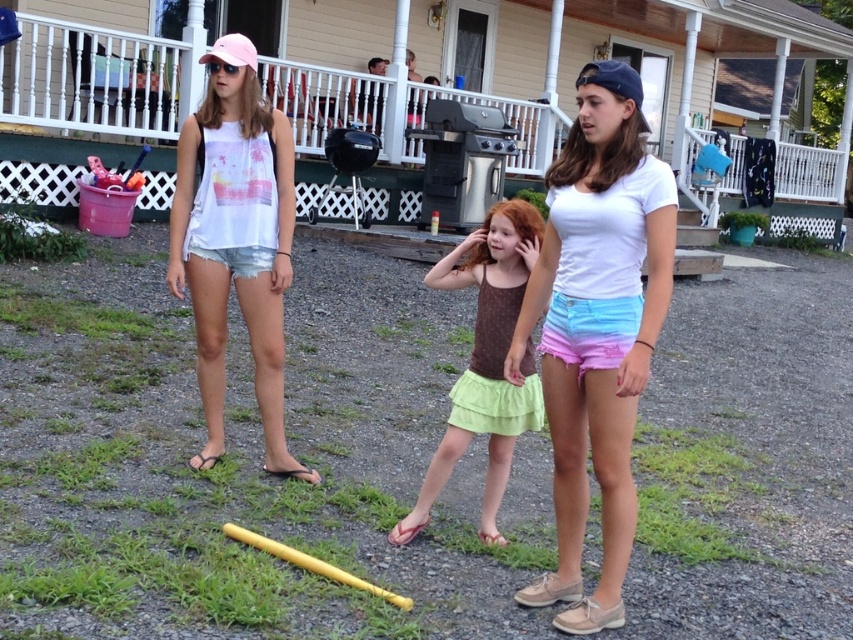
Question: Is yellow plastic bat at center thinner than white cotton t-shirt at center?

Choices:
 (A) yes
 (B) no

Answer: (B)

Question: Is yellow plastic bat at center smaller than white cotton t-shirt at center?

Choices:
 (A) yes
 (B) no

Answer: (B)

Question: Estimate the real-world distances between objects in this image. Which object is closer to the brown dotted tank top at center?

Choices:
 (A) yellow matte baseball bat at lower center
 (B) yellow plastic bat at center
 (C) white cotton t-shirt at center

Answer: (C)

Question: Which of the following is the farthest from the observer?

Choices:
 (A) brown dotted tank top at center
 (B) wooden porch at upper center

Answer: (B)

Question: Which object appears farthest from the camera in this image?

Choices:
 (A) denim shorts at left
 (B) yellow plastic bat at center
 (C) white cotton t-shirt at center

Answer: (A)

Question: Is wooden porch at upper center below denim shorts at left?

Choices:
 (A) no
 (B) yes

Answer: (A)